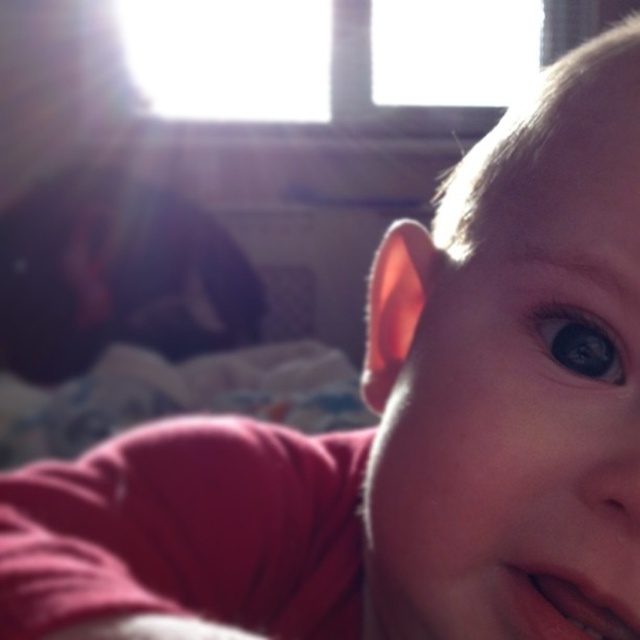
You are a photographer taking a closeup shot of the child. The camera lens is positioned at the viewer position. The pink glossy lips at lower right are the main subject. To ensure the lips are in focus, the camera needs to be focused at a distance of 8.69 inches. Is the current focus distance set correctly?

Yes, the current focus distance is set correctly because the pink glossy lips at lower right and the viewer are 8.69 inches apart, so focusing at that distance will keep the lips in focus.

You are a photographer adjusting lighting for a portrait. You notice the pink glossy lips at lower right and the shiny blue eye at center in the image. Which object will cast a larger shadow due to the window light at top center?

The pink glossy lips at lower right will cast a larger shadow because it is much taller than the shiny blue eye at center, so its shadow will be longer.

You are a photographer adjusting the focus of your camera. The camera is currently focused on the window at the top center. Do you need to adjust the focus to capture the pink glossy lips at lower right clearly?

The pink glossy lips at lower right are located at point (563,604), which is not the current focus point on the window at the top center. Therefore, you need to adjust the focus to the pink glossy lips at lower right to capture them clearly.